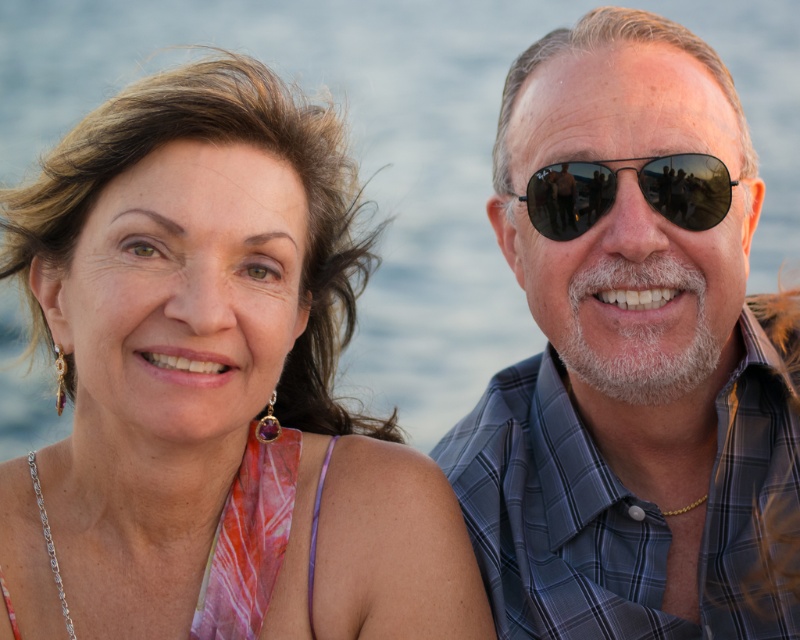
Looking at this image, you are a photographer standing at the camera position. You want to capture a closeup shot of the matte gold earrings at upper left. Given that your camera has a maximum zoom range of 100 feet, will you be able to achieve this without moving closer?

The matte gold earrings at upper left are 140.39 feet away from the camera. Since the camera can only zoom up to 100 feet, it cannot capture a closeup of the matte gold earrings at upper left without moving closer.

You are a photographer standing 10 meters away from the two people in the image. You want to capture a closeup shot of both the matte gold earrings at upper left and the matte black sunglasses at right in a single frame. Is this possible with a standard camera lens that has a maximum zoom range of 5 meters?

The distance between the matte gold earrings at upper left and the matte black sunglasses at right is 6.05 meters. Since the camera lens can only zoom up to 5 meters, it would not be possible to capture both objects in a single frame without moving closer.